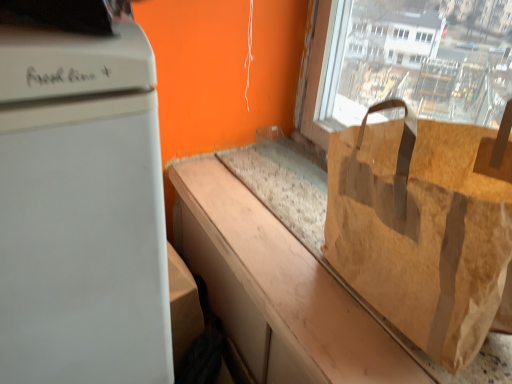
Question: From a real-world perspective, relative to brown paper bag at right, is brown paper bag at center vertically above or below?

Choices:
 (A) above
 (B) below

Answer: (B)

Question: Is brown paper bag at center inside or outside of brown paper bag at right?

Choices:
 (A) outside
 (B) inside

Answer: (A)

Question: Based on their relative distances, which object is farther from the brown paper bag at right?

Choices:
 (A) white matte refrigerator at left
 (B) brown paper bag at center

Answer: (A)

Question: Which of these objects is positioned closest to the brown paper bag at center?

Choices:
 (A) brown paper bag at right
 (B) white matte refrigerator at left

Answer: (A)